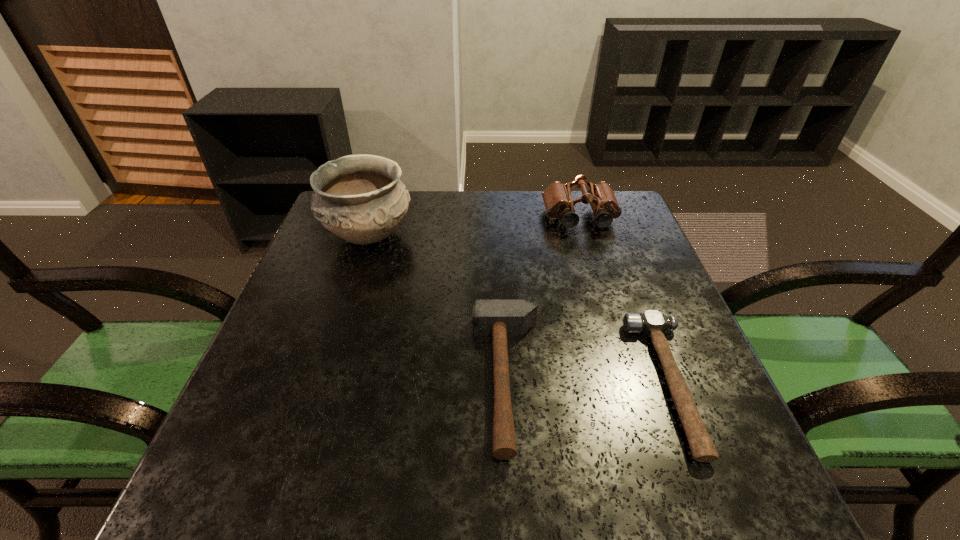
The width and height of the screenshot is (960, 540). Find the location of `object at the far left corner`. object at the far left corner is located at coordinates (360, 198).

Identify the location of object that is at the far right corner. This screenshot has height=540, width=960. [x=557, y=198].

Find the location of a particular element. The image size is (960, 540). object located in the near right corner section of the desktop is located at coordinates (652, 322).

Find the location of a particular element. The height and width of the screenshot is (540, 960). vacant space at the far edge of the desktop is located at coordinates (506, 209).

In the image, there is a desktop. Identify the location of vacant space at the near edge. The image size is (960, 540). (508, 462).

The width and height of the screenshot is (960, 540). In the image, there is a desktop. What are the coordinates of `vacant space at the left edge` in the screenshot? It's located at (306, 444).

What are the coordinates of `free location at the right edge of the desktop` in the screenshot? It's located at (684, 347).

Identify the location of free space at the far right corner. (588, 205).

In the image, there is a desktop. What are the coordinates of `vacant space at the near right corner` in the screenshot? It's located at (747, 482).

Where is `free space between the binoculars and the tallest object`? This screenshot has width=960, height=540. free space between the binoculars and the tallest object is located at coordinates (474, 227).